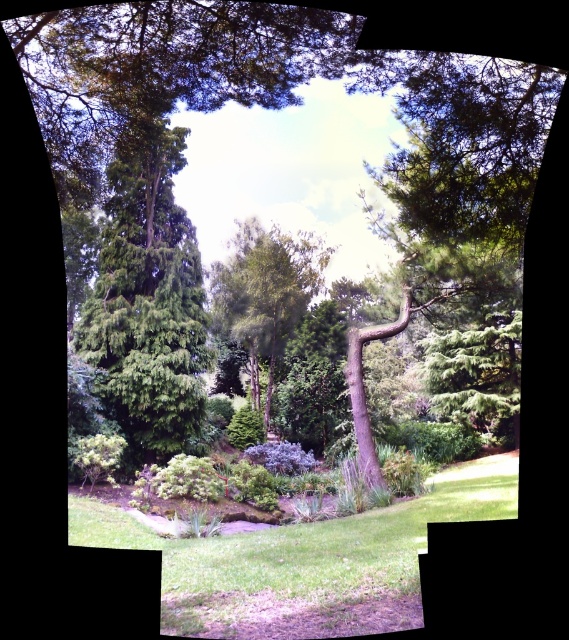
The image size is (569, 640). Describe the element at coordinates (147, 298) in the screenshot. I see `green textured tree at left` at that location.

Find the location of a particular element. This screenshot has height=640, width=569. green textured tree at left is located at coordinates (147, 298).

Is point (172, 561) closer to viewer compared to point (284, 324)?

Yes, point (172, 561) is closer to viewer.

Who is more distant from viewer, (336, 563) or (269, 244)?

The point (269, 244) is behind.

Where is `green grass at center`? green grass at center is located at coordinates (304, 561).

Is green grass at center thinner than green textured tree at left?

In fact, green grass at center might be wider than green textured tree at left.

Which is above, green grass at center or green textured tree at left?

green textured tree at left is above.

Where is `green grass at center`? Image resolution: width=569 pixels, height=640 pixels. green grass at center is located at coordinates (304, 561).